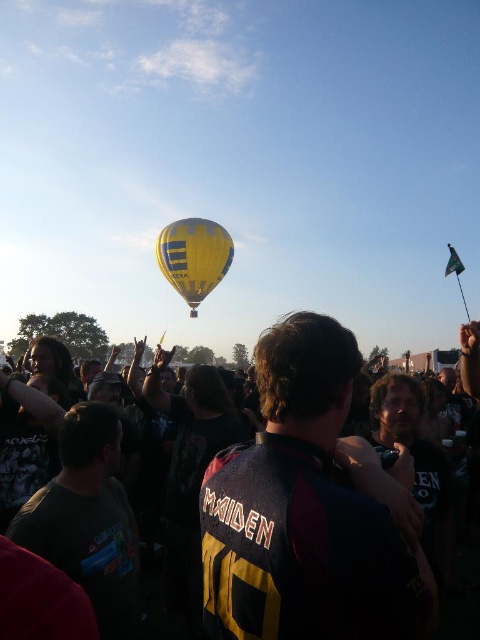
Question: Observing the image, what is the correct spatial positioning of dark gray jersey at center in reference to yellow fabric balloon at center?

Choices:
 (A) below
 (B) above

Answer: (A)

Question: Which of the following is the closest to the observer?

Choices:
 (A) (203, 548)
 (B) (163, 268)

Answer: (A)

Question: Is dark gray jersey at center below yellow fabric balloon at center?

Choices:
 (A) no
 (B) yes

Answer: (B)

Question: Is dark gray jersey at center behind yellow fabric balloon at center?

Choices:
 (A) yes
 (B) no

Answer: (B)

Question: Which object is farther from the camera taking this photo?

Choices:
 (A) dark gray jersey at center
 (B) yellow fabric balloon at center

Answer: (B)